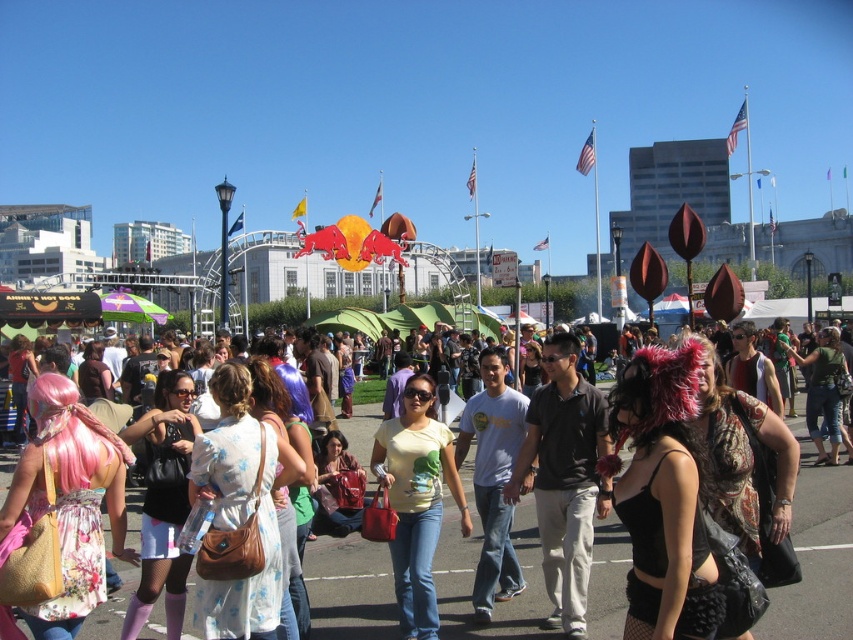
Between point (589, 476) and point (416, 625), which one is positioned behind?

Point (589, 476)

Can you confirm if dark gray polo shirt at center is taller than yellow matte shirt at center?

Correct, dark gray polo shirt at center is much taller as yellow matte shirt at center.

I want to click on dark gray polo shirt at center, so click(x=564, y=477).

Based on the photo, measure the distance between floral dress at center and yellow matte shirt at center.

They are 20.18 feet apart.

Between point (476, 515) and point (376, 444), which one is positioned behind?

The point (476, 515) is more distant.

Locate an element on the screen. Image resolution: width=853 pixels, height=640 pixels. floral dress at center is located at coordinates (816, 556).

Does floral dress at center appear on the right side of dark gray polo shirt at center?

Incorrect, floral dress at center is not on the right side of dark gray polo shirt at center.

Does floral dress at center appear on the left side of dark gray polo shirt at center?

Indeed, floral dress at center is positioned on the left side of dark gray polo shirt at center.

The image size is (853, 640). Find the location of `floral dress at center`. floral dress at center is located at coordinates (816, 556).